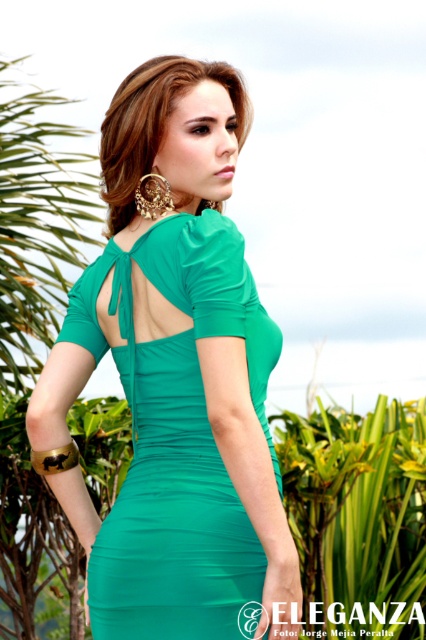
You are a fashion designer observing the image. You need to determine if the emerald green dress at center can be displayed on a mannequin that has a maximum dress size capacity of 10. Given that the shiny gold earrings at upper center are standard size, can the dress fit?

The emerald green dress at center has a larger size compared to the shiny gold earrings at upper center. Since the earrings are standard size, the dress exceeds the mannequin size limit of 10 and cannot be displayed.

You are a fashion designer observing the image. You need to determine if the emerald green dress at center can be worn by a client who has a narrow torso. Based on the description, can you confirm if the dress is wider than the shiny gold earrings at upper center?

The emerald green dress at center is wider than the shiny gold earrings at upper center, so it may not be suitable for a client with a narrow torso as the dress is wider than the earrings.